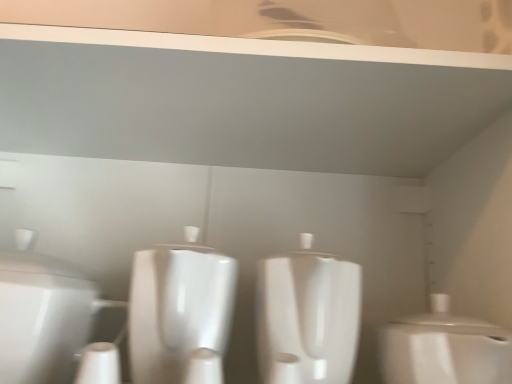
At what (x,y) coordinates should I click in order to perform the action: click on white glossy toilet at center, acting as the 2th toilet starting from the right. Please return your answer as a coordinate pair (x, y). Image resolution: width=512 pixels, height=384 pixels. Looking at the image, I should click on (307, 316).

I want to click on white glossy toilet at right, which is the first toilet from right to left, so click(x=444, y=348).

Image resolution: width=512 pixels, height=384 pixels. What are the coordinates of `white glossy toilet at left, the 1th toilet when ordered from left to right` in the screenshot? It's located at (42, 315).

From a real-world perspective, between white glossy toilet at left, the 1th toilet when ordered from left to right, and white glossy toilet at right, which is the third toilet from left to right, who is vertically lower?

In real-world perspective, white glossy toilet at right, which is the third toilet from left to right, is lower.

From the image's perspective, relative to white glossy toilet at right, which is the third toilet from left to right, is white glossy toilet at left, the third toilet from the right, above or below?

white glossy toilet at left, the third toilet from the right, is situated higher than white glossy toilet at right, which is the third toilet from left to right, in the image.

Is the surface of white glossy toilet at left, the 1th toilet when ordered from left to right, in direct contact with white glossy toilet at right, which is the first toilet from right to left?

No, white glossy toilet at left, the 1th toilet when ordered from left to right, is not beside white glossy toilet at right, which is the first toilet from right to left.

Looking at this image, considering the relative sizes of white glossy toilet at left, the third toilet from the right, and white glossy toilet at right, which is the first toilet from right to left, in the image provided, is white glossy toilet at left, the third toilet from the right, taller than white glossy toilet at right, which is the first toilet from right to left,?

Correct, white glossy toilet at left, the third toilet from the right, is much taller as white glossy toilet at right, which is the first toilet from right to left.

Is point (342, 379) closer to viewer compared to point (42, 325)?

That is False.

Which of these two, white glossy toilet at center, acting as the 2th toilet starting from the right, or white glossy toilet at left, the 1th toilet when ordered from left to right, stands shorter?

With less height is white glossy toilet at left, the 1th toilet when ordered from left to right.

Who is smaller, white glossy toilet at center, acting as the 2th toilet starting from the right, or white glossy toilet at left, the 1th toilet when ordered from left to right?

white glossy toilet at center, acting as the 2th toilet starting from the right, is smaller.

Which object is thinner, white glossy toilet at center, positioned as the second toilet in left-to-right order, or white glossy toilet at left, the 1th toilet when ordered from left to right?

With smaller width is white glossy toilet at center, positioned as the second toilet in left-to-right order.

Is the surface of white glossy toilet at center, acting as the 2th toilet starting from the right, in direct contact with white glossy toilet at right, which is the first toilet from right to left?

No, white glossy toilet at center, acting as the 2th toilet starting from the right, is not in contact with white glossy toilet at right, which is the first toilet from right to left.

From a real-world perspective, is white glossy toilet at center, acting as the 2th toilet starting from the right, above or below white glossy toilet at right, which is the first toilet from right to left?

Clearly, from a real-world perspective, white glossy toilet at center, acting as the 2th toilet starting from the right, is above white glossy toilet at right, which is the first toilet from right to left.

From the image's perspective, is white glossy toilet at center, positioned as the second toilet in left-to-right order, below white glossy toilet at right, which is the third toilet from left to right?

Actually, white glossy toilet at center, positioned as the second toilet in left-to-right order, appears above white glossy toilet at right, which is the third toilet from left to right, in the image.

Could you measure the distance between white glossy toilet at center, positioned as the second toilet in left-to-right order, and white glossy toilet at right, which is the first toilet from right to left?

white glossy toilet at center, positioned as the second toilet in left-to-right order, is 4.69 inches from white glossy toilet at right, which is the first toilet from right to left.

Based on the photo, looking at their sizes, would you say white glossy toilet at right, which is the first toilet from right to left, is wider or thinner than white glossy toilet at left, the 1th toilet when ordered from left to right?

Considering their sizes, white glossy toilet at right, which is the first toilet from right to left, looks slimmer than white glossy toilet at left, the 1th toilet when ordered from left to right.

From the image's perspective, between white glossy toilet at right, which is the third toilet from left to right, and white glossy toilet at left, the third toilet from the right, who is located below?

From the image's view, white glossy toilet at right, which is the third toilet from left to right, is below.

Would you say white glossy toilet at right, which is the first toilet from right to left, contains white glossy toilet at left, the 1th toilet when ordered from left to right?

Actually, white glossy toilet at left, the 1th toilet when ordered from left to right, is outside white glossy toilet at right, which is the first toilet from right to left.

Measure the distance from white glossy toilet at left, the third toilet from the right, to white glossy toilet at center, acting as the 2th toilet starting from the right.

24.40 centimeters.

Is white glossy toilet at left, the third toilet from the right, facing towards white glossy toilet at center, acting as the 2th toilet starting from the right?

No, white glossy toilet at left, the third toilet from the right, is not aimed at white glossy toilet at center, acting as the 2th toilet starting from the right.

Can you tell me how much white glossy toilet at left, the 1th toilet when ordered from left to right, and white glossy toilet at center, positioned as the second toilet in left-to-right order, differ in facing direction?

0.000246 degrees separate the facing orientations of white glossy toilet at left, the 1th toilet when ordered from left to right, and white glossy toilet at center, positioned as the second toilet in left-to-right order.

Can white glossy toilet at center, acting as the 2th toilet starting from the right, be found inside white glossy toilet at left, the third toilet from the right?

No, white glossy toilet at left, the third toilet from the right, does not contain white glossy toilet at center, acting as the 2th toilet starting from the right.

Locate an element on the screen. This screenshot has height=384, width=512. toilet that is below the white glossy toilet at center, acting as the 2th toilet starting from the right (from the image's perspective) is located at coordinates (444, 348).

Is point (485, 366) closer or farther from the camera than point (282, 256)?

Clearly, point (485, 366) is closer to the camera than point (282, 256).

Is white glossy toilet at right, which is the third toilet from left to right, taller or shorter than white glossy toilet at center, positioned as the second toilet in left-to-right order?

Clearly, white glossy toilet at right, which is the third toilet from left to right, is shorter compared to white glossy toilet at center, positioned as the second toilet in left-to-right order.

Can you tell me how much white glossy toilet at right, which is the third toilet from left to right, and white glossy toilet at center, positioned as the second toilet in left-to-right order, differ in facing direction?

There is a 0.00623-degree angle between the facing directions of white glossy toilet at right, which is the third toilet from left to right, and white glossy toilet at center, positioned as the second toilet in left-to-right order.

Starting from the white glossy toilet at right, which is the third toilet from left to right, which toilet is the 2nd one to the left? Please provide its 2D coordinates.

[(42, 315)]

I want to click on toilet that is the 1st one when counting downward from the white glossy toilet at left, the third toilet from the right (from the image's perspective), so coord(307,316).

From the image, which object appears to be farther from white glossy toilet at left, the third toilet from the right, white glossy toilet at center, acting as the 2th toilet starting from the right, or white glossy toilet at right, which is the third toilet from left to right?

white glossy toilet at right, which is the third toilet from left to right, lies further to white glossy toilet at left, the third toilet from the right, than the other object.

Estimate the real-world distances between objects in this image. Which object is further from white glossy toilet at center, positioned as the second toilet in left-to-right order, white glossy toilet at right, which is the third toilet from left to right, or white glossy toilet at left, the third toilet from the right?

white glossy toilet at left, the third toilet from the right, is further to white glossy toilet at center, positioned as the second toilet in left-to-right order.

Based on their spatial positions, is white glossy toilet at left, the third toilet from the right, or white glossy toilet at right, which is the first toilet from right to left, further from white glossy toilet at center, acting as the 2th toilet starting from the right?

Based on the image, white glossy toilet at left, the third toilet from the right, appears to be further to white glossy toilet at center, acting as the 2th toilet starting from the right.

From the image, which object appears to be nearer to white glossy toilet at left, the third toilet from the right, white glossy toilet at right, which is the first toilet from right to left, or white glossy toilet at center, acting as the 2th toilet starting from the right?

white glossy toilet at center, acting as the 2th toilet starting from the right.

Which object lies nearer to the anchor point white glossy toilet at right, which is the third toilet from left to right, white glossy toilet at left, the 1th toilet when ordered from left to right, or white glossy toilet at center, acting as the 2th toilet starting from the right?

white glossy toilet at center, acting as the 2th toilet starting from the right, is closer to white glossy toilet at right, which is the third toilet from left to right.

Based on their spatial positions, is white glossy toilet at center, acting as the 2th toilet starting from the right, or white glossy toilet at left, the 1th toilet when ordered from left to right, further from white glossy toilet at right, which is the first toilet from right to left?

The object further to white glossy toilet at right, which is the first toilet from right to left, is white glossy toilet at left, the 1th toilet when ordered from left to right.

Locate an element on the screen. This screenshot has height=384, width=512. toilet located between white glossy toilet at left, the 1th toilet when ordered from left to right, and white glossy toilet at right, which is the third toilet from left to right, in the left-right direction is located at coordinates (307, 316).